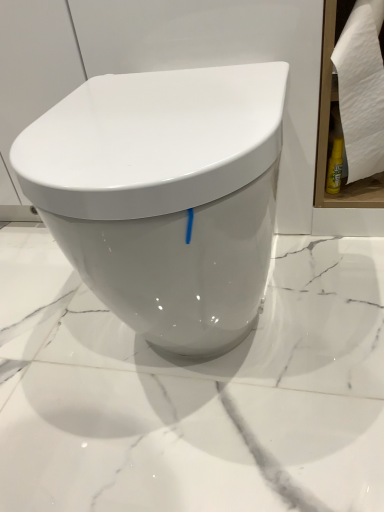
You are a GUI agent. You are given a task and a screenshot of the screen. Output one action in this format:
    pyautogui.click(x=<x>, y=<y>)
    Task: Click on the free region under white glossy toilet at center (from a real-world perspective)
    
    Given the screenshot: What is the action you would take?
    pyautogui.click(x=214, y=348)